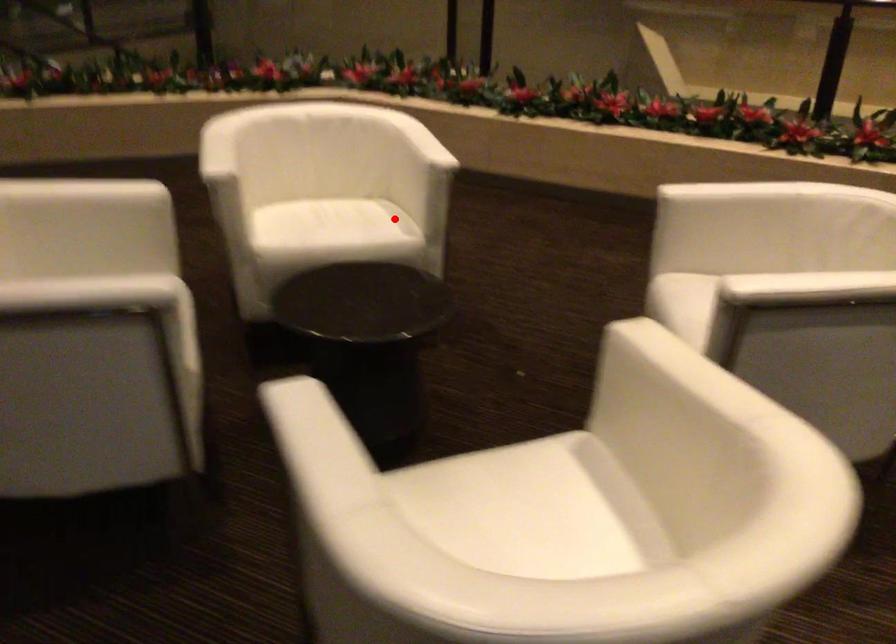
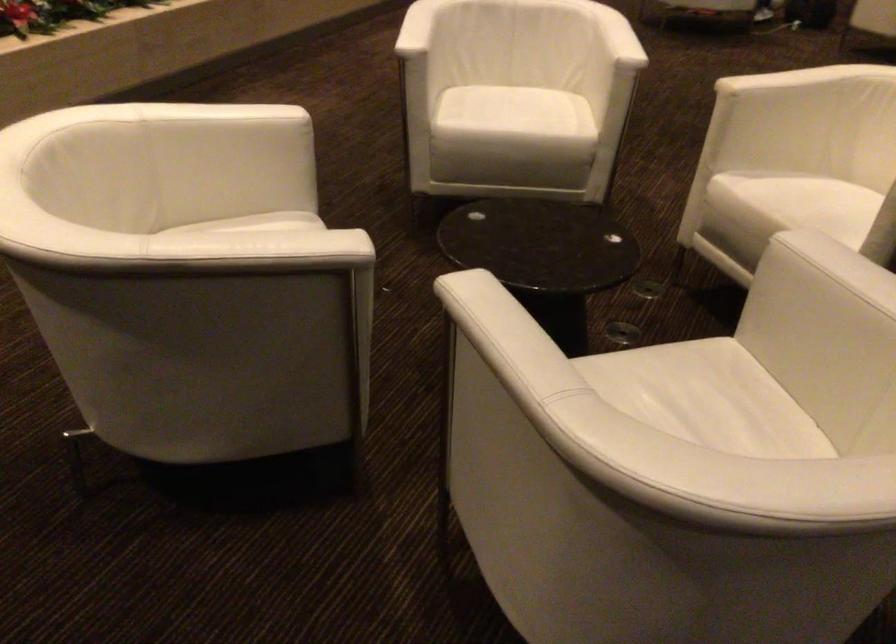
In the second image, find the point that corresponds to the highlighted location in the first image.

(265, 223)